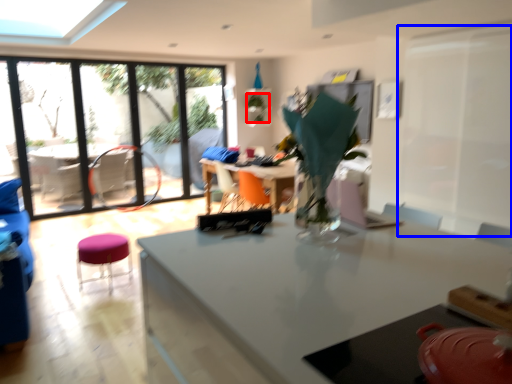
Question: Which object appears farthest to the camera in this image, plant (highlighted by a red box) or screen door (highlighted by a blue box)?

Choices:
 (A) plant
 (B) screen door

Answer: (A)